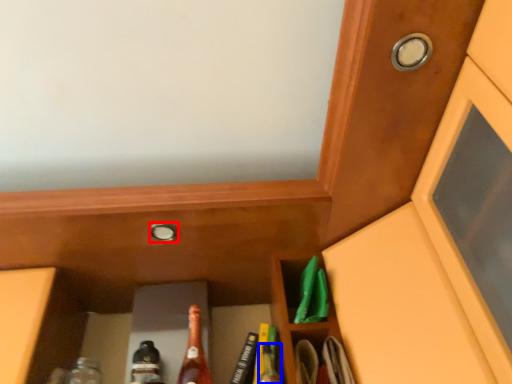
Question: Among these objects, which one is farthest to the camera, knob (highlighted by a red box) or bottle (highlighted by a blue box)?

Choices:
 (A) knob
 (B) bottle

Answer: (A)